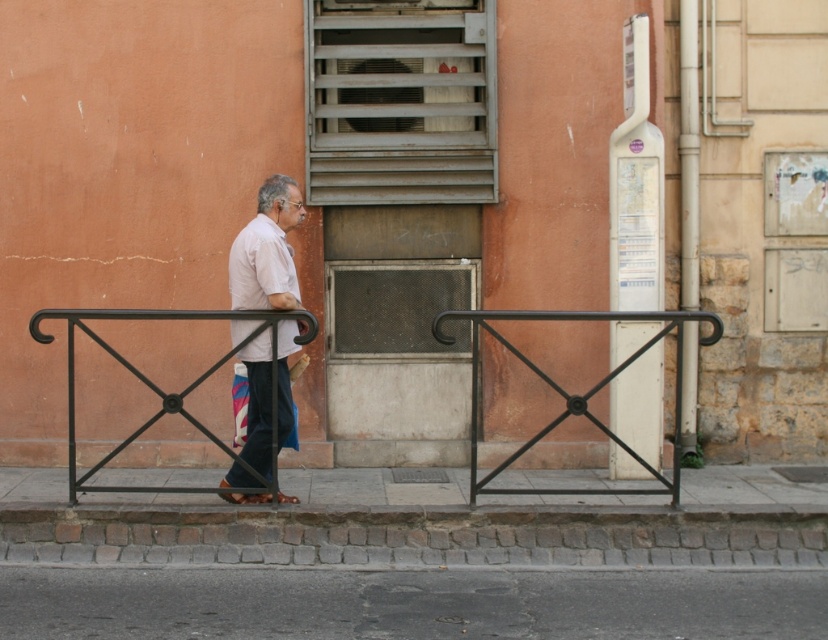
Between point (248, 323) and point (177, 488), which one is positioned in front?

Positioned in front is point (177, 488).

Is point (265, 332) less distant than point (282, 314)?

No.

Who is more distant from viewer, [282,438] or [167,403]?

The point [282,438] is behind.

Find the location of a particular element. This screenshot has width=828, height=640. white cotton shirt at center is located at coordinates (267, 250).

Between gray asphalt at lower center and black metal balustrade at center, which one has more height?

Standing taller between the two is black metal balustrade at center.

Can you confirm if gray asphalt at lower center is bigger than black metal balustrade at center?

No.

What do you see at coordinates (408, 604) in the screenshot? I see `gray asphalt at lower center` at bounding box center [408, 604].

The width and height of the screenshot is (828, 640). I want to click on gray asphalt at lower center, so [408, 604].

Between black metal rail at center and black metal balustrade at center, which one appears on the left side from the viewer's perspective?

black metal balustrade at center is more to the left.

Does black metal rail at center have a larger size compared to black metal balustrade at center?

Yes, black metal rail at center is bigger than black metal balustrade at center.

Where is `black metal rail at center`? black metal rail at center is located at coordinates (575, 394).